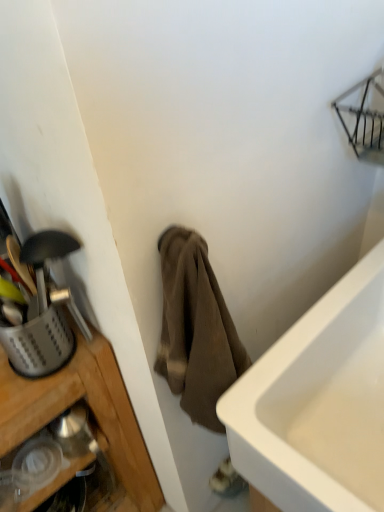
Question: Would you say silver/metallic utensil basket at left contains brown cotton towel at center?

Choices:
 (A) no
 (B) yes

Answer: (A)

Question: From a real-world perspective, does silver/metallic utensil basket at left sit lower than brown cotton towel at center?

Choices:
 (A) yes
 (B) no

Answer: (B)

Question: Is silver/metallic utensil basket at left smaller than brown cotton towel at center?

Choices:
 (A) no
 (B) yes

Answer: (B)

Question: Considering the relative positions of silver/metallic utensil basket at left and brown cotton towel at center in the image provided, is silver/metallic utensil basket at left to the left of brown cotton towel at center from the viewer's perspective?

Choices:
 (A) yes
 (B) no

Answer: (A)

Question: Could you tell me if silver/metallic utensil basket at left is facing brown cotton towel at center?

Choices:
 (A) yes
 (B) no

Answer: (B)

Question: Is silver/metallic utensil basket at left next to brown cotton towel at center and touching it?

Choices:
 (A) yes
 (B) no

Answer: (B)

Question: Is brown cotton towel at center at the left side of silver/metallic utensil basket at left?

Choices:
 (A) yes
 (B) no

Answer: (B)

Question: Is brown cotton towel at center wider than silver/metallic utensil basket at left?

Choices:
 (A) no
 (B) yes

Answer: (B)

Question: Is brown cotton towel at center thinner than silver/metallic utensil basket at left?

Choices:
 (A) yes
 (B) no

Answer: (B)

Question: Would you say brown cotton towel at center is a long distance from silver/metallic utensil basket at left?

Choices:
 (A) yes
 (B) no

Answer: (B)

Question: Can you confirm if brown cotton towel at center is shorter than silver/metallic utensil basket at left?

Choices:
 (A) yes
 (B) no

Answer: (B)

Question: Does brown cotton towel at center lie in front of silver/metallic utensil basket at left?

Choices:
 (A) yes
 (B) no

Answer: (A)

Question: From the image's perspective, is silver/metallic utensil basket at left positioned above or below brown cotton towel at center?

Choices:
 (A) above
 (B) below

Answer: (A)